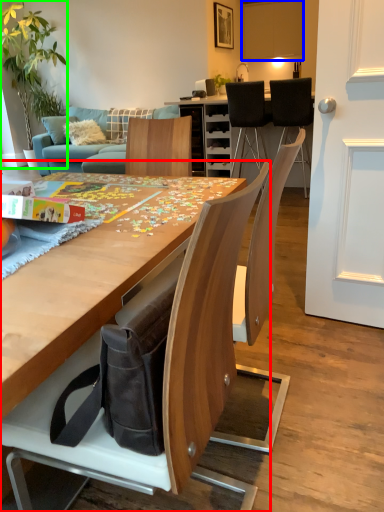
Question: Which object is the farthest from chair (highlighted by a red box)? Choose among these: cabinetry (highlighted by a blue box) or houseplant (highlighted by a green box).

Choices:
 (A) cabinetry
 (B) houseplant

Answer: (A)